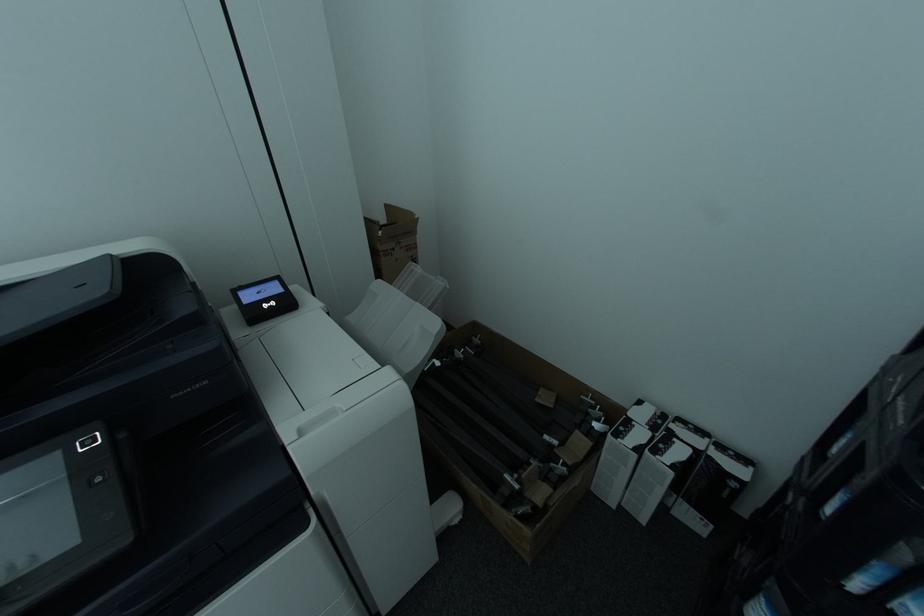
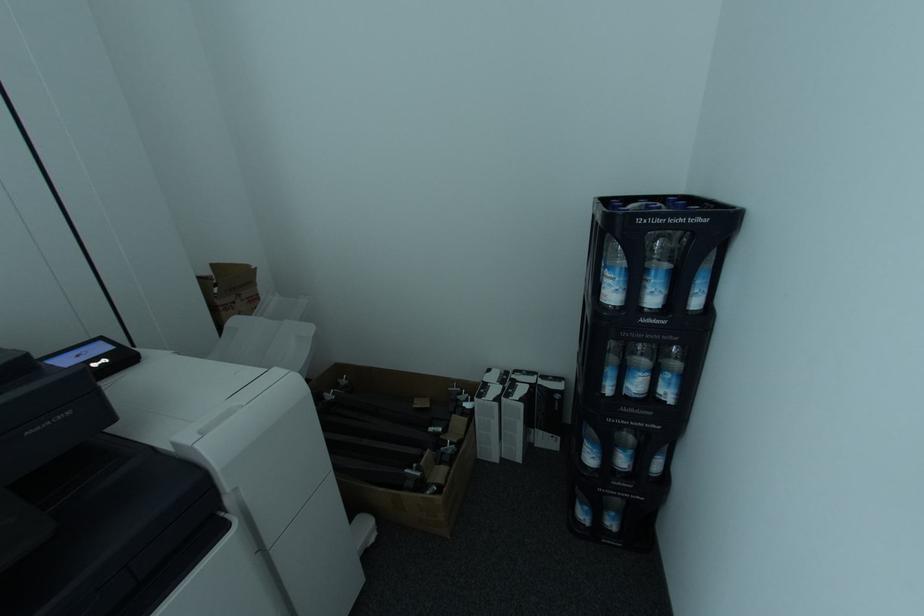
Question: The camera is either moving clockwise (left) or counter-clockwise (right) around the object. The first image is from the beginning of the video and the second image is from the end. Is the camera moving left or right when shooting the video?

Choices:
 (A) Left
 (B) Right

Answer: (A)